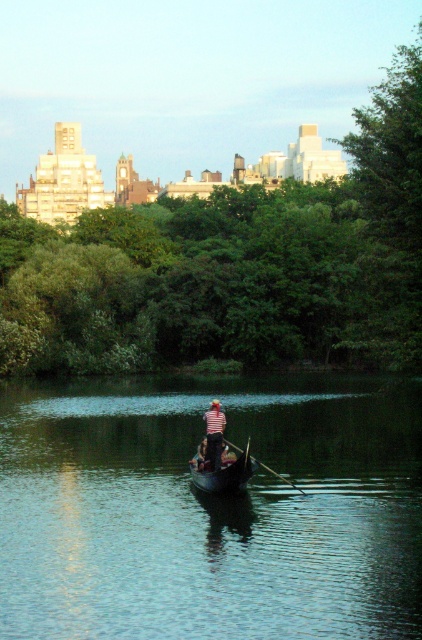
Question: Is dark brown wooden canoe at center to the left of striped fabric person at center from the viewer's perspective?

Choices:
 (A) no
 (B) yes

Answer: (A)

Question: Does dark brown wooden canoe at center have a lesser width compared to wooden polished paddle at center?

Choices:
 (A) no
 (B) yes

Answer: (B)

Question: Is green smooth water at center wider than wooden polished paddle at center?

Choices:
 (A) no
 (B) yes

Answer: (B)

Question: Which object is closer to the camera taking this photo?

Choices:
 (A) wooden polished paddle at center
 (B) striped fabric person at center
 (C) green smooth water at center
 (D) dark brown wooden canoe at center

Answer: (C)

Question: Which point is closer to the camera?

Choices:
 (A) (186, 602)
 (B) (262, 467)
 (C) (197, 467)

Answer: (A)

Question: Among these points, which one is farthest from the camera?

Choices:
 (A) (276, 472)
 (B) (227, 476)
 (C) (221, 420)
 (D) (54, 534)

Answer: (A)